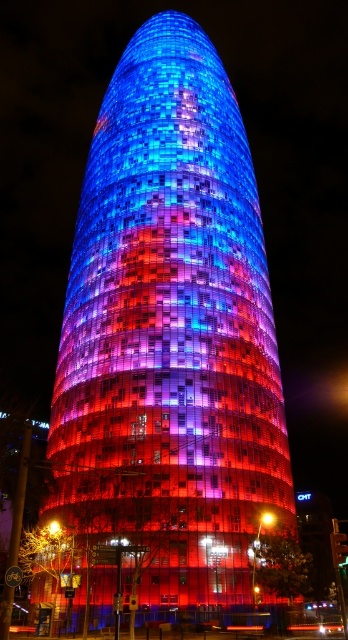
You are standing in front of the skyscraper and want to locate two specific points on its facade. The first point is at coordinates point (x=81, y=595) and the second is at point (x=271, y=522). Which of these points is nearer to your current position?

Point (x=81, y=595) is closer to the viewer than point (x=271, y=522).

You are an architect evaluating the design of the shiny glass tower at center and the matte glass light at center. Which object has a greater width according to the provided information?

The shiny glass tower at center has a greater width than the matte glass light at center.

You are standing in the city square and want to take a photo of the shiny glass tower at center. If your camera can focus on objects up to 30 meters away, will you need to adjust your position to capture a clear image?

The shiny glass tower at center is 35.19 meters away from the camera, which exceeds the camera maximum focus range of 30 meters. You need to move closer to the shiny glass tower at center to ensure it is within the focus range.